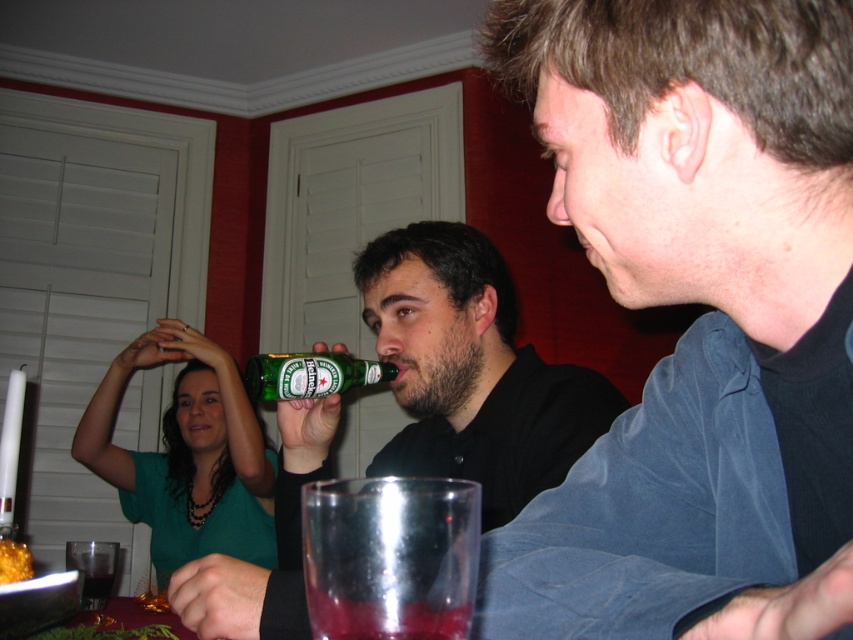
Question: Is green matte beer bottle at center below clear plastic cup at lower left?

Choices:
 (A) yes
 (B) no

Answer: (B)

Question: Which object is farther from the camera taking this photo?

Choices:
 (A) green glass bottle at center
 (B) green matte beer bottle at center
 (C) clear plastic cup at lower left
 (D) green matte shirt at upper left

Answer: (D)

Question: Among these points, which one is farthest from the camera?

Choices:
 (A) (193, 346)
 (B) (299, 376)
 (C) (525, 483)
 (D) (4, 564)

Answer: (A)

Question: Which object is positioned farthest from the green glass bottle at center?

Choices:
 (A) golden crumbly pastry at lower left
 (B) transparent glass at lower center
 (C) green matte beer bottle at center

Answer: (B)

Question: Does green matte shirt at upper left have a smaller size compared to golden crumbly pastry at lower left?

Choices:
 (A) yes
 (B) no

Answer: (B)

Question: Can you confirm if green matte beer bottle at center is bigger than clear plastic cup at lower left?

Choices:
 (A) no
 (B) yes

Answer: (B)